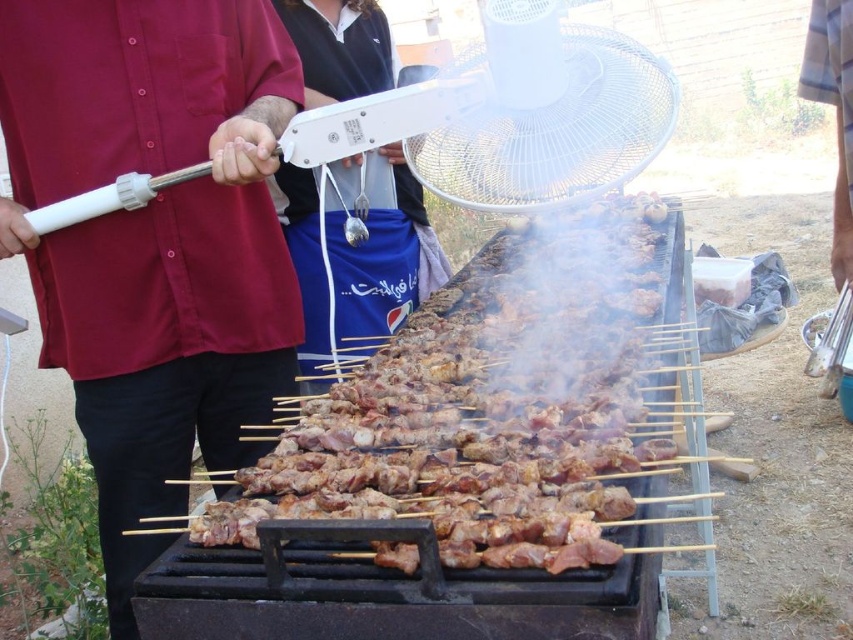
This screenshot has height=640, width=853. Identify the location of dark blue fabric pants at center. pos(381,256).

Measure the distance between point (374,61) and camera.

They are 7.63 feet apart.

Where is `dark blue fabric pants at center`? Image resolution: width=853 pixels, height=640 pixels. dark blue fabric pants at center is located at coordinates pyautogui.click(x=381, y=256).

Based on the photo, can you confirm if maroon shirt at center is wider than dark blue fabric pants at center?

Yes.

Does point (161, 317) come closer to viewer compared to point (434, 266)?

Yes, point (161, 317) is in front of point (434, 266).

The image size is (853, 640). I want to click on maroon shirt at center, so click(x=154, y=240).

Can you confirm if brown/crumbly meat skewers at center is shorter than dark blue fabric pants at center?

Correct, brown/crumbly meat skewers at center is not as tall as dark blue fabric pants at center.

Does point (627, 396) come in front of point (305, 227)?

Yes, point (627, 396) is closer to viewer.

At what (x,y) coordinates should I click in order to perform the action: click on brown/crumbly meat skewers at center. Please return your answer as a coordinate pair (x, y). The width and height of the screenshot is (853, 640). Looking at the image, I should click on (488, 406).